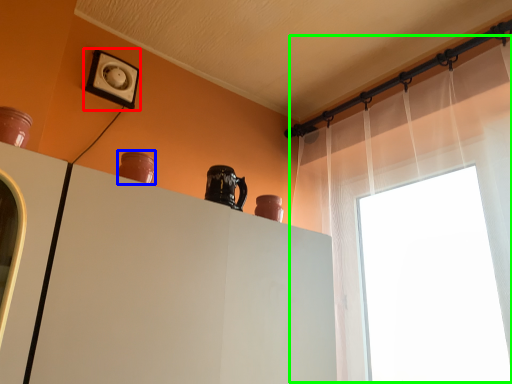
Question: Which object is positioned closest to electric outlet (highlighted by a red box)? Select from vase (highlighted by a blue box) and shower curtain (highlighted by a green box).

Choices:
 (A) vase
 (B) shower curtain

Answer: (A)